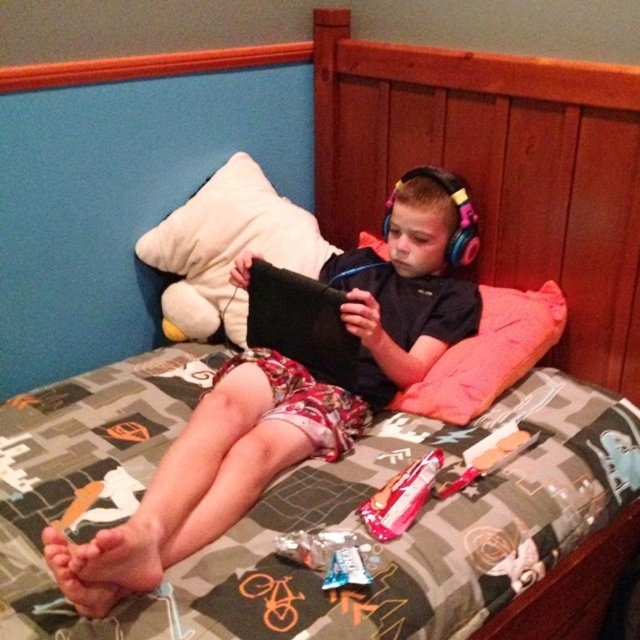
Question: Is black matte tablet at center positioned behind pink fabric pillow at upper right?

Choices:
 (A) no
 (B) yes

Answer: (A)

Question: Which point is closer to the camera taking this photo?

Choices:
 (A) (609, 320)
 (B) (483, 332)
 (C) (260, 170)
 (D) (232, 424)

Answer: (D)

Question: Does wooden at upper center appear on the right side of black matte tablet at center?

Choices:
 (A) yes
 (B) no

Answer: (A)

Question: Where is black matte tablet at center located in relation to white plush at upper left in the image?

Choices:
 (A) right
 (B) left

Answer: (A)

Question: Which object appears farthest from the camera in this image?

Choices:
 (A) wooden at upper center
 (B) black matte tablet at center
 (C) pink fabric pillow at upper right
 (D) white plush at upper left

Answer: (D)

Question: Which point is farther to the camera?

Choices:
 (A) (436, 371)
 (B) (634, 352)
 (C) (248, 172)
 (D) (339, 444)

Answer: (C)